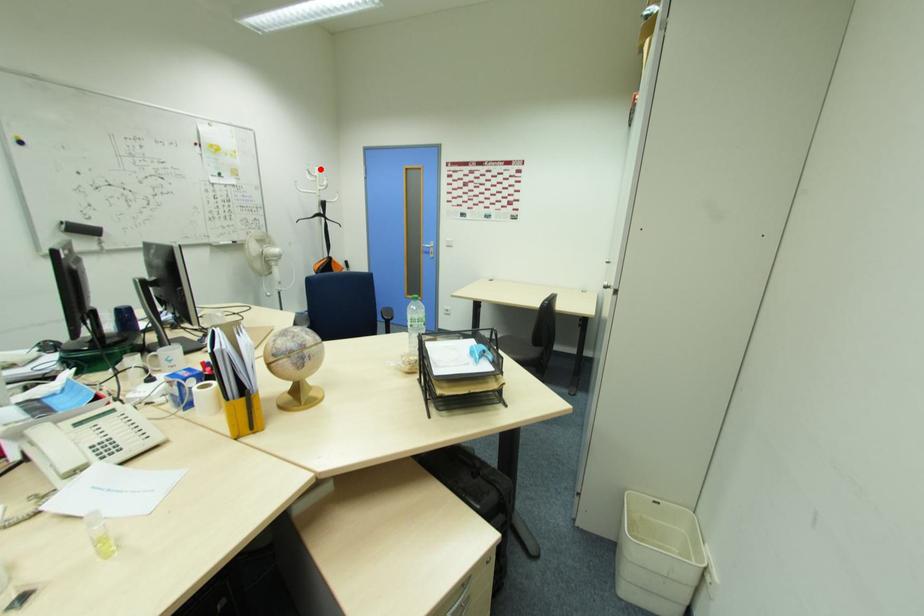
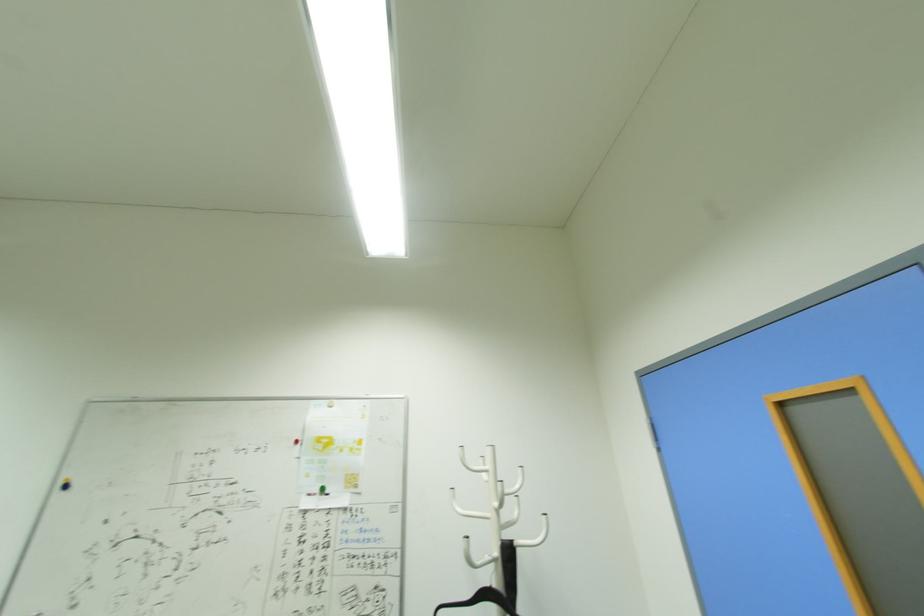
In the second image, find the point that corresponds to the highlighted location in the first image.

(493, 451)